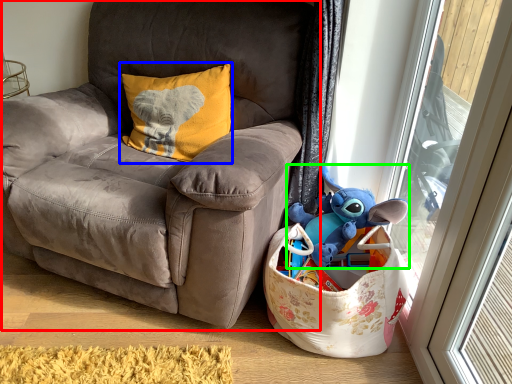
Question: Which object is the farthest from chair (highlighted by a red box)? Choose among these: pillow (highlighted by a blue box) or toy (highlighted by a green box).

Choices:
 (A) pillow
 (B) toy

Answer: (B)